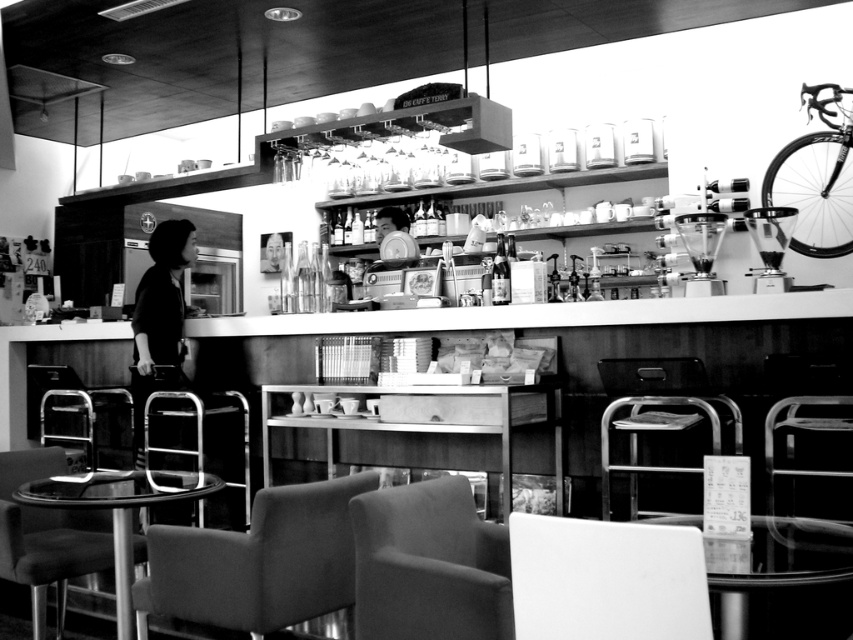
You are standing in the modern cafe and want to reach both the point at coordinates point (689,634) and point (200,444). Which point should you walk towards first to minimize the total distance traveled?

You should walk towards point (689,634) first because it is closer to you than point (200,444), so reaching it first minimizes the backtracking needed.